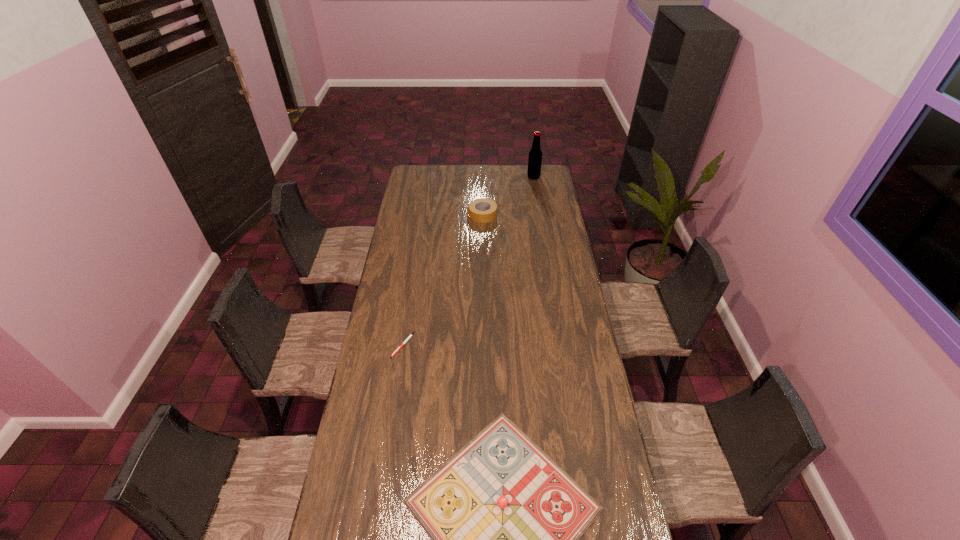
What are the coordinates of `vacant region located 0.380m on the clicker of the pen` in the screenshot? It's located at [x=387, y=450].

Identify the location of object that is at the far edge. The image size is (960, 540). pos(535,155).

Identify the location of object positioned at the left edge. (410, 336).

What are the coordinates of `object that is at the right edge` in the screenshot? It's located at (535, 155).

Image resolution: width=960 pixels, height=540 pixels. What are the coordinates of `object located at the far right corner` in the screenshot? It's located at (535, 155).

Image resolution: width=960 pixels, height=540 pixels. What are the coordinates of `free space at the far edge of the desktop` in the screenshot? It's located at (477, 174).

Where is `vacant space at the left edge`? The image size is (960, 540). vacant space at the left edge is located at coordinates (375, 451).

In order to click on free location at the right edge of the desktop in this screenshot , I will do `click(571, 358)`.

The width and height of the screenshot is (960, 540). I want to click on free space that is in between the leftmost object and the second tallest object, so click(x=443, y=280).

What are the coordinates of `free spot between the third nearest object and the pen` in the screenshot? It's located at (443, 280).